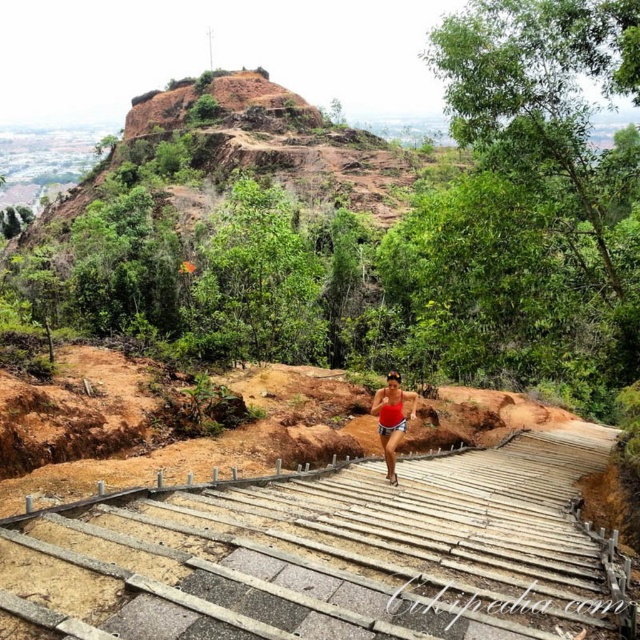
Does wooden stairs at center appear over red matte tank top at center?

No.

Does wooden stairs at center have a smaller size compared to red matte tank top at center?

No.

Measure the distance between wooden stairs at center and camera.

wooden stairs at center and camera are 4.23 meters apart.

Where is `wooden stairs at center`? wooden stairs at center is located at coordinates (333, 554).